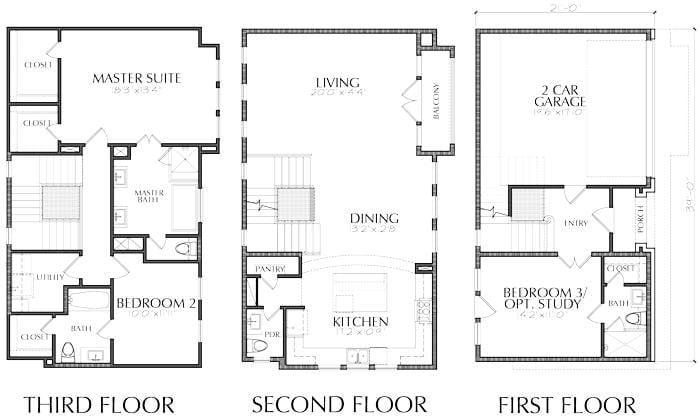
What are the coordinates of `staircases` in the screenshot? It's located at (292, 171), (304, 240), (265, 206), (63, 232), (27, 205), (60, 168), (530, 235).